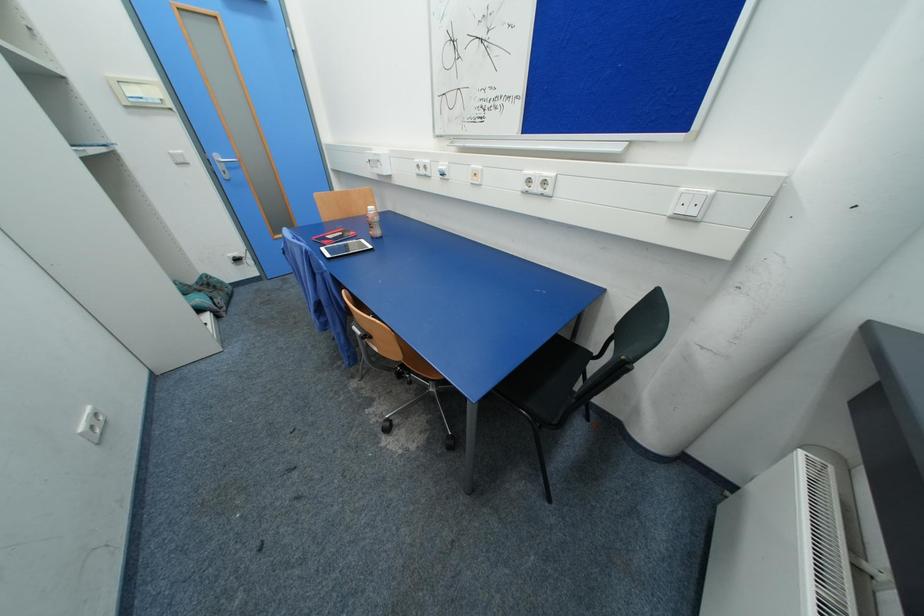
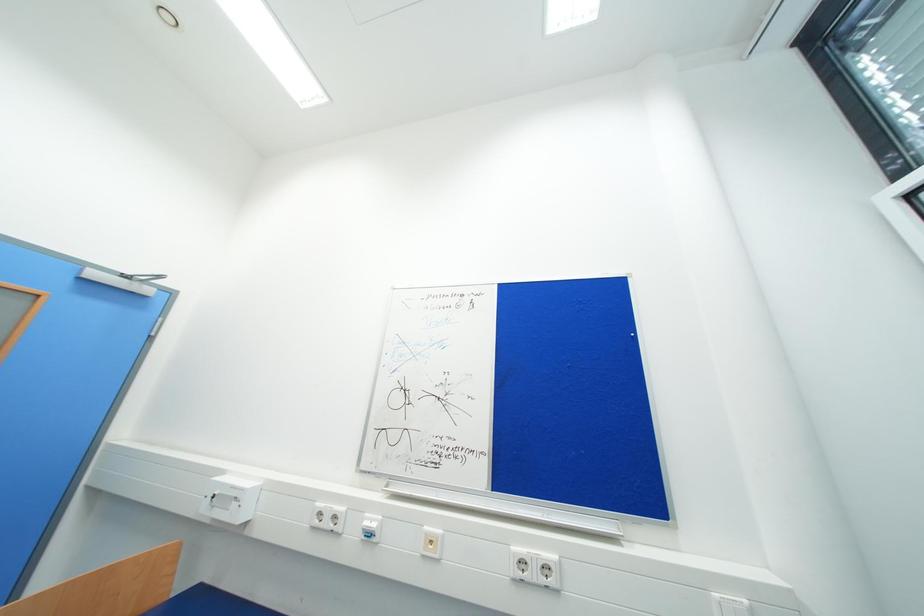
Based on the continuous images, in which direction is the camera rotating?

The camera rotated toward right-up.